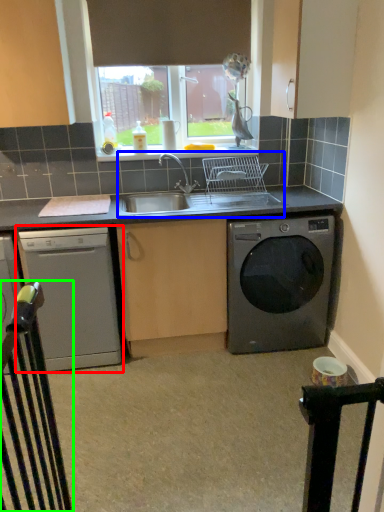
Question: Which object is positioned farthest from dishwasher (highlighted by a red box)? Select from sink (highlighted by a blue box) and rail (highlighted by a green box).

Choices:
 (A) sink
 (B) rail

Answer: (B)